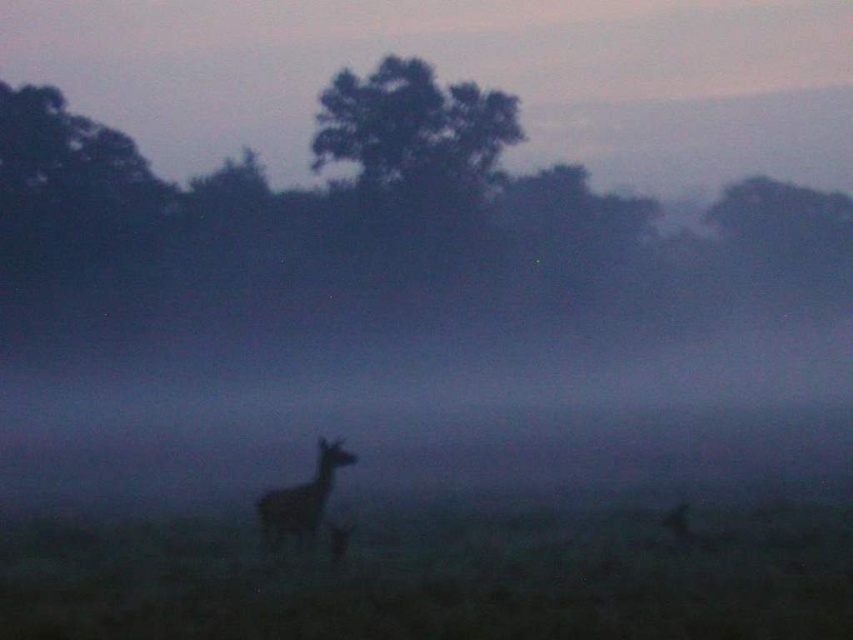
You are standing in the misty landscape and want to walk from the point at coordinates point (403, 58) to the point at coordinates point (271, 493). Which direction should you face to move towards the second point?

To move from point (403, 58) to point (271, 493), you should face towards the right and slightly downward, as point (271, 493) is located to the right and lower in the image compared to point (403, 58).

You are an observer in the misty landscape scene. You see a green leafy tree at upper center and a silhouette fur deer at center. Which object appears wider in the scene?

The green leafy tree at upper center might be wider than the silhouette fur deer at center according to the description.